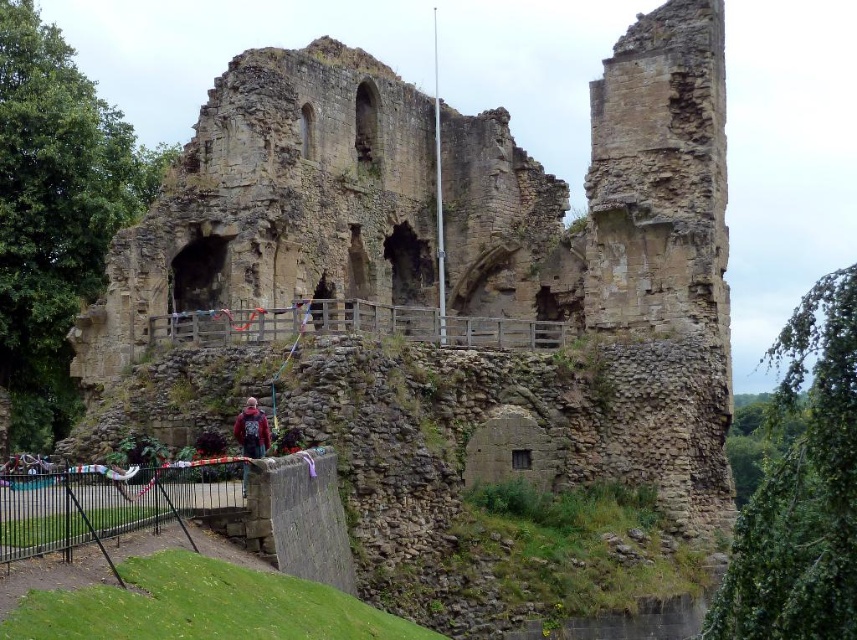
From the picture: You are standing at the point closest to the metal fence in the medieval ruins. You want to take a photo of the stone walls while including both the point at coordinates point [476,248] and point [237,428] in your shot. Which point should you position closer to the camera to ensure both points are in frame?

To include both points in the frame, position point [237,428] closer to the camera since point [476,248] is behind it. This way, the foreground point will be visible while the background point remains in the shot.

In the scene shown: You are standing at the base of the brown stone ruins at center and looking up. There is a dark red sweater at center nearby. Which object is higher in elevation?

The brown stone ruins at center are higher in elevation than the dark red sweater at center because the ruins are at the center and the sweater is at the base.